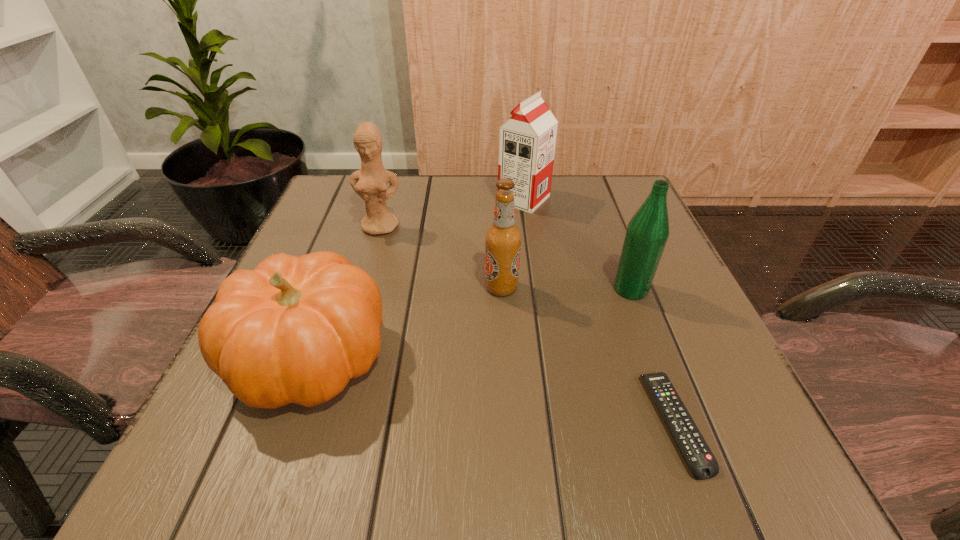
Identify the location of vacant point at the far right corner. The image size is (960, 540). (636, 194).

The image size is (960, 540). What are the coordinates of `vacant area at the near right corner` in the screenshot? It's located at (769, 481).

Where is `vacant area that lies between the beer bottle and the remote control`? This screenshot has width=960, height=540. vacant area that lies between the beer bottle and the remote control is located at coordinates click(x=588, y=355).

In order to click on free point between the soya milk and the bottle in this screenshot , I will do `click(577, 244)`.

You are a GUI agent. You are given a task and a screenshot of the screen. Output one action in this format:
    pyautogui.click(x=<x>, y=<y>)
    Task: Click on the vacant area that lies between the farthest object and the remote control
    
    Given the screenshot: What is the action you would take?
    pyautogui.click(x=599, y=311)

The height and width of the screenshot is (540, 960). I want to click on empty space between the beer bottle and the remote control, so click(588, 355).

At what (x,y) coordinates should I click in order to perform the action: click on vacant space that's between the beer bottle and the second shortest object. Please return your answer as a coordinate pair (x, y). Looking at the image, I should click on (406, 322).

Where is `vacant area that lies between the soya milk and the second farthest object`? The height and width of the screenshot is (540, 960). vacant area that lies between the soya milk and the second farthest object is located at coordinates (452, 213).

At what (x,y) coordinates should I click in order to perform the action: click on object that is the fifth nearest to the farthest object. Please return your answer as a coordinate pair (x, y). Looking at the image, I should click on (702, 463).

At what (x,y) coordinates should I click in order to perform the action: click on object that is the second closest one to the bottle. Please return your answer as a coordinate pair (x, y). Image resolution: width=960 pixels, height=540 pixels. Looking at the image, I should click on (503, 239).